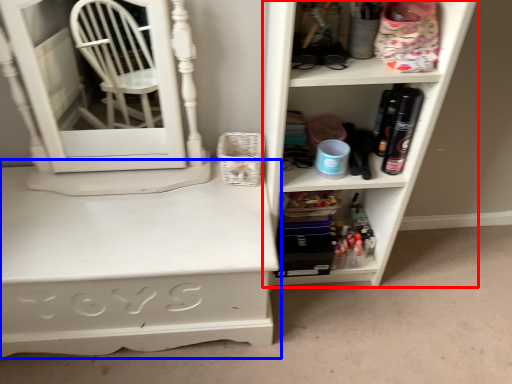
Question: Among these objects, which one is nearest to the camera, shelf (highlighted by a red box) or desk (highlighted by a blue box)?

Choices:
 (A) shelf
 (B) desk

Answer: (A)